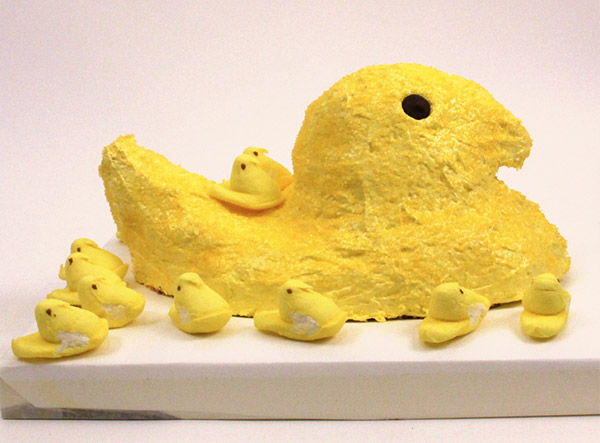
The width and height of the screenshot is (600, 443). In order to click on beige wall in this screenshot , I will do `click(182, 90)`.